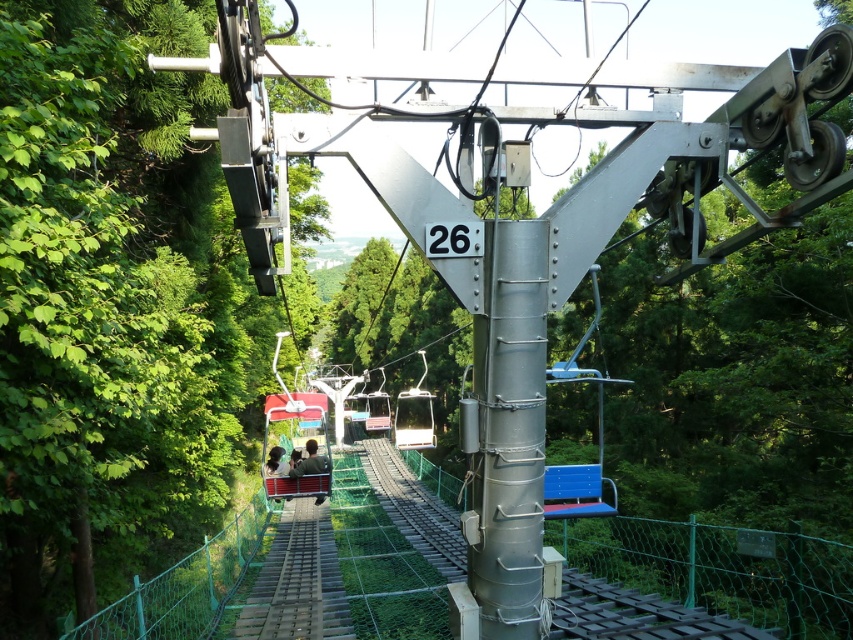
Question: Which of the following is the closest to the observer?

Choices:
 (A) matte black jacket at center
 (B) metallic silver ski lift at center

Answer: (A)

Question: Which of the following is the farthest from the observer?

Choices:
 (A) (317, 499)
 (B) (422, 426)

Answer: (B)

Question: Is metallic gray pole at center wider than metallic silver ski lift at center?

Choices:
 (A) no
 (B) yes

Answer: (A)

Question: Which is farther from the matte black jacket at center?

Choices:
 (A) metallic silver ski lift at center
 (B) metallic gray pole at center

Answer: (A)

Question: Is metallic gray pole at center closer to camera compared to metallic silver ski lift at center?

Choices:
 (A) yes
 (B) no

Answer: (A)

Question: Where is green fabric jacket at center located in relation to matte black jacket at center in the image?

Choices:
 (A) below
 (B) above

Answer: (B)